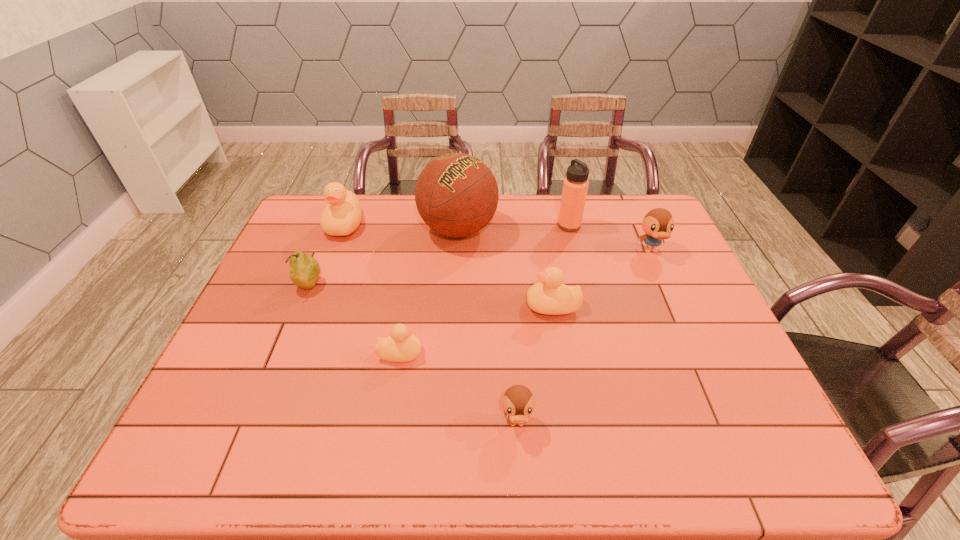
Where is `yellow duck that stands as the second closest to the leftmost yellow duck`? yellow duck that stands as the second closest to the leftmost yellow duck is located at coordinates (549, 296).

Identify which yellow duck is located as the third nearest to the nearest object. Please provide its 2D coordinates. Your answer should be formatted as a tuple, i.e. [(x, y)], where the tuple contains the x and y coordinates of a point satisfying the conditions above.

[(342, 216)]

The image size is (960, 540). What are the coordinates of `free spot that satisfies the following two spatial constraints: 1. on the front-facing side of the right blue duck; 2. on the face of the nearest yellow duck` in the screenshot? It's located at (696, 353).

This screenshot has width=960, height=540. I want to click on free space in the image that satisfies the following two spatial constraints: 1. on the back side of the basketball; 2. on the right side of the pear, so click(332, 230).